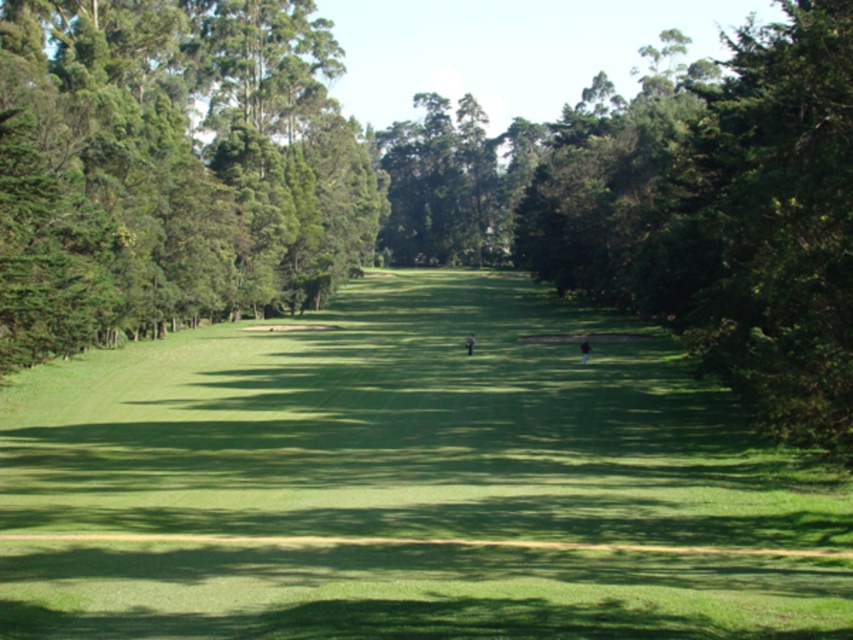
Is green grassy field at center above dark brown leather golfer at center?

Incorrect, green grassy field at center is not positioned above dark brown leather golfer at center.

Does green grassy field at center have a lesser height compared to dark brown leather golfer at center?

No.

What do you see at coordinates (407, 483) in the screenshot? Image resolution: width=853 pixels, height=640 pixels. I see `green grassy field at center` at bounding box center [407, 483].

I want to click on green grassy field at center, so click(x=407, y=483).

Who is taller, dark brown leather golfer at center or dark gray fabric golfer at center?

With more height is dark gray fabric golfer at center.

Looking at this image, does dark brown leather golfer at center have a lesser width compared to dark gray fabric golfer at center?

No.

Who is more distant from viewer, (583, 348) or (469, 344)?

Positioned behind is point (469, 344).

Find the location of `dark brown leather golfer at center`. dark brown leather golfer at center is located at coordinates (584, 349).

Between green grassy field at center and green leafy trees at left, which one has more height?

With more height is green leafy trees at left.

The image size is (853, 640). What do you see at coordinates (407, 483) in the screenshot? I see `green grassy field at center` at bounding box center [407, 483].

Is point (425, 458) farther from camera compared to point (178, 156)?

No.

Locate an element on the screen. green grassy field at center is located at coordinates pos(407,483).